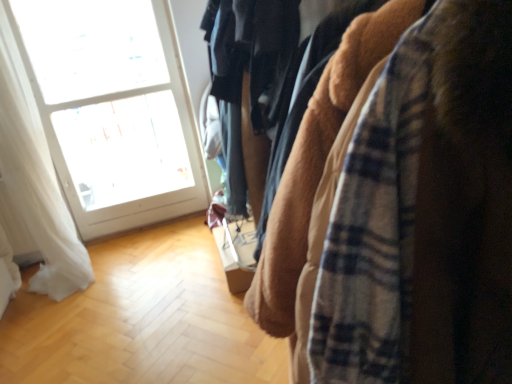
Question: Should I look upward or downward to see white glass window at upper left?

Choices:
 (A) down
 (B) up

Answer: (B)

Question: Does plaid flannel shirt at right have a greater width compared to white glass window at upper left?

Choices:
 (A) no
 (B) yes

Answer: (B)

Question: From the image's perspective, is plaid flannel shirt at right located beneath white glass window at upper left?

Choices:
 (A) yes
 (B) no

Answer: (A)

Question: From a real-world perspective, is plaid flannel shirt at right on white glass window at upper left?

Choices:
 (A) yes
 (B) no

Answer: (B)

Question: Are plaid flannel shirt at right and white glass window at upper left beside each other?

Choices:
 (A) no
 (B) yes

Answer: (A)

Question: Is plaid flannel shirt at right at the right side of white glass window at upper left?

Choices:
 (A) yes
 (B) no

Answer: (A)

Question: Considering the relative positions of plaid flannel shirt at right and white glass window at upper left in the image provided, is plaid flannel shirt at right behind white glass window at upper left?

Choices:
 (A) yes
 (B) no

Answer: (B)

Question: Considering the relative sizes of white glass window at upper left and white sheer curtain at left in the image provided, is white glass window at upper left bigger than white sheer curtain at left?

Choices:
 (A) yes
 (B) no

Answer: (B)

Question: Can you confirm if white glass window at upper left is wider than white sheer curtain at left?

Choices:
 (A) yes
 (B) no

Answer: (B)

Question: Considering the relative sizes of white glass window at upper left and white sheer curtain at left in the image provided, is white glass window at upper left smaller than white sheer curtain at left?

Choices:
 (A) no
 (B) yes

Answer: (B)

Question: Can you confirm if white glass window at upper left is thinner than white sheer curtain at left?

Choices:
 (A) no
 (B) yes

Answer: (B)

Question: From a real-world perspective, is white glass window at upper left positioned over white sheer curtain at left based on gravity?

Choices:
 (A) no
 (B) yes

Answer: (B)

Question: Is white glass window at upper left facing away from white sheer curtain at left?

Choices:
 (A) no
 (B) yes

Answer: (A)

Question: Is white glass window at upper left at the right side of plaid flannel shirt at right?

Choices:
 (A) yes
 (B) no

Answer: (B)